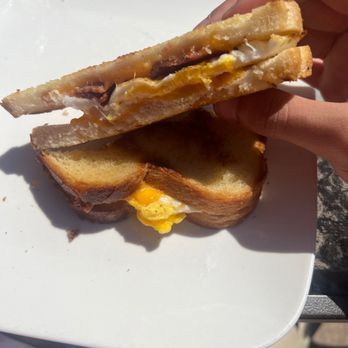
The width and height of the screenshot is (348, 348). Find the location of `white plate`. white plate is located at coordinates (136, 241), (52, 38).